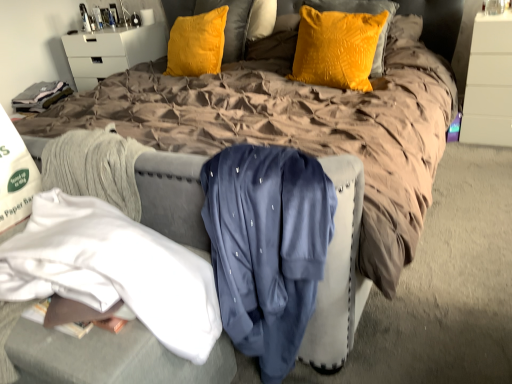
Describe the element at coordinates (113, 270) in the screenshot. I see `white fabric at lower left, which ranks as the 1th clothing in left-to-right order` at that location.

Looking at this image, what is the approximate height of white fabric at lower left, which ranks as the 1th clothing in left-to-right order?

28.27 centimeters.

The height and width of the screenshot is (384, 512). What do you see at coordinates (197, 44) in the screenshot?
I see `velvet yellow pillow at center, the first pillow viewed from the left` at bounding box center [197, 44].

Find the location of a particular element. The height and width of the screenshot is (384, 512). brown quilted bed at center is located at coordinates (296, 130).

Find the location of a particular element. Image resolution: width=512 pixels, height=384 pixels. white glossy nightstand at upper left is located at coordinates (111, 52).

Where is `white fabric at lower left, which ranks as the 1th clothing in left-to-right order`? white fabric at lower left, which ranks as the 1th clothing in left-to-right order is located at coordinates (113, 270).

From the image's perspective, is white glossy nightstand at upper left under white glossy dresser at upper right?

Actually, white glossy nightstand at upper left appears above white glossy dresser at upper right in the image.

From the picture: Considering the sizes of white glossy nightstand at upper left and white glossy dresser at upper right in the image, is white glossy nightstand at upper left taller or shorter than white glossy dresser at upper right?

white glossy nightstand at upper left is shorter than white glossy dresser at upper right.

Is white glossy nightstand at upper left thinner than white glossy dresser at upper right?

Yes.

Can white glossy dresser at upper right be found inside white glossy nightstand at upper left?

No, white glossy dresser at upper right is not surrounded by white glossy nightstand at upper left.

From the image's perspective, who appears lower, white glossy nightstand at upper left or velvet yellow pillow at upper center, marked as the 1th pillow in a right-to-left arrangement?

velvet yellow pillow at upper center, marked as the 1th pillow in a right-to-left arrangement.

Relative to velvet yellow pillow at upper center, which is the 2th pillow in back-to-front order, is white glossy nightstand at upper left in front or behind?

white glossy nightstand at upper left is positioned farther from the viewer than velvet yellow pillow at upper center, which is the 2th pillow in back-to-front order.

Find the location of a particular element. pillow that is the 2nd one when counting downward from the white glossy nightstand at upper left (from the image's perspective) is located at coordinates (336, 48).

Consider the image. How distant is velvet yellow pillow at center, which is the first pillow from back to front, from white glossy dresser at upper right?

velvet yellow pillow at center, which is the first pillow from back to front, is 1.48 meters from white glossy dresser at upper right.

Are velvet yellow pillow at center, which is the first pillow from back to front, and white glossy dresser at upper right far apart?

Absolutely, velvet yellow pillow at center, which is the first pillow from back to front, is distant from white glossy dresser at upper right.

Would you say velvet yellow pillow at center, which is the first pillow from back to front, contains white glossy dresser at upper right?

No, velvet yellow pillow at center, which is the first pillow from back to front, does not contain white glossy dresser at upper right.

Is point (170, 60) closer or farther from the camera than point (499, 54)?

Point (170, 60).

Which object is positioned more to the left, white fabric at lower left, which ranks as the 1th clothing in left-to-right order, or velvet yellow pillow at upper center, the second pillow viewed from the left?

white fabric at lower left, which ranks as the 1th clothing in left-to-right order.

Which object is closer to the camera, white fabric at lower left, which ranks as the 1th clothing in left-to-right order, or velvet yellow pillow at upper center, the second pillow viewed from the left?

white fabric at lower left, which ranks as the 1th clothing in left-to-right order, is closer to the camera.

Starting from the velvet yellow pillow at upper center, the second pillow viewed from the left, which clothing is the 2nd one to the left? Please provide its 2D coordinates.

[(113, 270)]

Does white fabric at lower left, the 2th clothing positioned from the right, turn towards velvet yellow pillow at upper center, which is the 2th pillow in back-to-front order?

No, white fabric at lower left, the 2th clothing positioned from the right, is not facing towards velvet yellow pillow at upper center, which is the 2th pillow in back-to-front order.

From the image's perspective, is brown quilted bed at center located above or below velvet yellow pillow at center, which is the second pillow from right to left?

Clearly, from the image's perspective, brown quilted bed at center is below velvet yellow pillow at center, which is the second pillow from right to left.

Does point (69, 99) come behind point (190, 71)?

That is False.

This screenshot has height=384, width=512. I want to click on pillow that is the 2nd object located above the brown quilted bed at center (from the image's perspective), so click(197, 44).

Are brown quilted bed at center and velvet yellow pillow at center, which is the first pillow from back to front, far apart?

brown quilted bed at center is actually quite close to velvet yellow pillow at center, which is the first pillow from back to front.

From a real-world perspective, which is physically below, velvet yellow pillow at center, which is the second pillow from front to back, or velvet yellow pillow at upper center, which is the 2th pillow in back-to-front order?

In real-world perspective, velvet yellow pillow at upper center, which is the 2th pillow in back-to-front order, is lower.

Looking at this image, is there a large distance between velvet yellow pillow at center, which is the second pillow from front to back, and velvet yellow pillow at upper center, the second pillow viewed from the left?

No.

Which object is positioned more to the right, velvet yellow pillow at center, which is the first pillow from back to front, or velvet yellow pillow at upper center, which appears as the first pillow when viewed from the front?

velvet yellow pillow at upper center, which appears as the first pillow when viewed from the front, is more to the right.

Consider the image. Is velvet yellow pillow at center, the first pillow viewed from the left, outside of velvet yellow pillow at upper center, which is the 2th pillow in back-to-front order?

That's correct, velvet yellow pillow at center, the first pillow viewed from the left, is outside of velvet yellow pillow at upper center, which is the 2th pillow in back-to-front order.

Is velvet yellow pillow at upper center, the second pillow viewed from the left, spatially inside white glossy dresser at upper right, or outside of it?

velvet yellow pillow at upper center, the second pillow viewed from the left, is spatially situated outside white glossy dresser at upper right.

Is velvet yellow pillow at upper center, which is the 2th pillow in back-to-front order, wider or thinner than white glossy dresser at upper right?

In the image, velvet yellow pillow at upper center, which is the 2th pillow in back-to-front order, appears to be more narrow than white glossy dresser at upper right.

This screenshot has width=512, height=384. In the image, there is a velvet yellow pillow at upper center, the second pillow viewed from the left. What are the coordinates of `dresser below it (from a real-world perspective)` in the screenshot? It's located at click(x=489, y=82).

Is point (305, 36) positioned in front of point (489, 111)?

Yes, it is.

Find the location of a particular element. dresser below the white glossy nightstand at upper left (from the image's perspective) is located at coordinates (489, 82).

Find the location of a particular element. the 2nd pillow in front of the white glossy nightstand at upper left is located at coordinates (336, 48).

Based on their spatial positions, is white glossy dresser at upper right or white fabric at lower left, which ranks as the 1th clothing in left-to-right order, further from brown quilted bed at center?

white glossy dresser at upper right.

When comparing their distances from white fabric at lower left, the 2th clothing positioned from the right, does white glossy dresser at upper right or white glossy nightstand at upper left seem further?

white glossy nightstand at upper left.

Looking at the image, which one is located further to white glossy nightstand at upper left, velvet yellow pillow at center, which is the second pillow from front to back, or white glossy dresser at upper right?

white glossy dresser at upper right.

From the image, which object appears to be farther from white glossy nightstand at upper left, white fabric at lower left, which ranks as the 1th clothing in left-to-right order, or velvet yellow pillow at center, the first pillow viewed from the left?

white fabric at lower left, which ranks as the 1th clothing in left-to-right order, is positioned further to the anchor white glossy nightstand at upper left.

Estimate the real-world distances between objects in this image. Which object is closer to white glossy dresser at upper right, velvet yellow pillow at upper center, marked as the 1th pillow in a right-to-left arrangement, or white fabric at lower left, which ranks as the 1th clothing in left-to-right order?

velvet yellow pillow at upper center, marked as the 1th pillow in a right-to-left arrangement, lies closer to white glossy dresser at upper right than the other object.

From the image, which object appears to be nearer to white fabric at lower left, the 2th clothing positioned from the right, white glossy dresser at upper right or velvet yellow pillow at upper center, which is the 2th pillow in back-to-front order?

Based on the image, velvet yellow pillow at upper center, which is the 2th pillow in back-to-front order, appears to be nearer to white fabric at lower left, the 2th clothing positioned from the right.

Which object lies further to the anchor point velvet yellow pillow at center, which is the second pillow from front to back, white glossy nightstand at upper left or brown quilted bed at center?

white glossy nightstand at upper left lies further to velvet yellow pillow at center, which is the second pillow from front to back, than the other object.

Considering their positions, is velvet yellow pillow at center, the first pillow viewed from the left, positioned further to white glossy dresser at upper right than brown quilted bed at center?

Based on the image, velvet yellow pillow at center, the first pillow viewed from the left, appears to be further to white glossy dresser at upper right.

At what (x,y) coordinates should I click in order to perform the action: click on clothing between brown quilted bed at center and navy blue satin shirt at center, which is the 2th clothing from left to right, vertically. Please return your answer as a coordinate pair (x, y). The width and height of the screenshot is (512, 384). Looking at the image, I should click on (113, 270).

This screenshot has height=384, width=512. In order to click on clothing between white fabric at lower left, the 2th clothing positioned from the right, and velvet yellow pillow at upper center, which is the 2th pillow in back-to-front order, along the z-axis in this screenshot , I will do `click(267, 247)`.

The width and height of the screenshot is (512, 384). Find the location of `clothing between white fabric at lower left, which ranks as the 1th clothing in left-to-right order, and white glossy nightstand at upper left from front to back`. clothing between white fabric at lower left, which ranks as the 1th clothing in left-to-right order, and white glossy nightstand at upper left from front to back is located at coordinates (267, 247).

The height and width of the screenshot is (384, 512). In order to click on pillow between brown quilted bed at center and velvet yellow pillow at center, which is the second pillow from front to back, from front to back in this screenshot , I will do `click(336, 48)`.